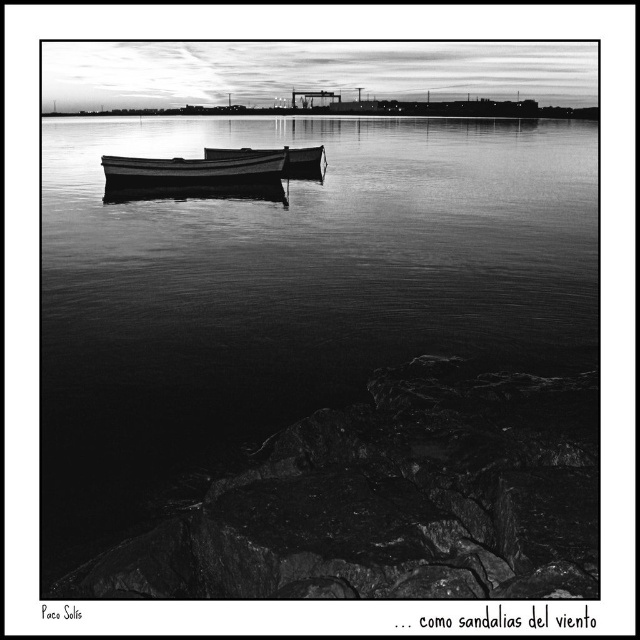
You are a photographer standing on the rocky shore in the foreground of the scene. You want to capture a photo of both the smooth water at center and the smooth wood canoe at center in the same frame. Given that your camera has a maximum focus range of 30 meters, will you be able to focus on both objects simultaneously?

The smooth water at center and smooth wood canoe at center are 34.64 meters apart from each other. Since the distance between them exceeds the camera maximum focus range of 30 meters, you cannot focus on both objects simultaneously.

You are a photographer standing on the rocky shore. You want to capture a photo where the wooden canoe at center is fully visible above the smooth water at center. Based on the scene, is this possible?

The smooth water at center is taller than the wooden canoe at center, so the canoe would be partially submerged or hidden by the water, making it difficult to fully capture the canoe above the water in the photo.